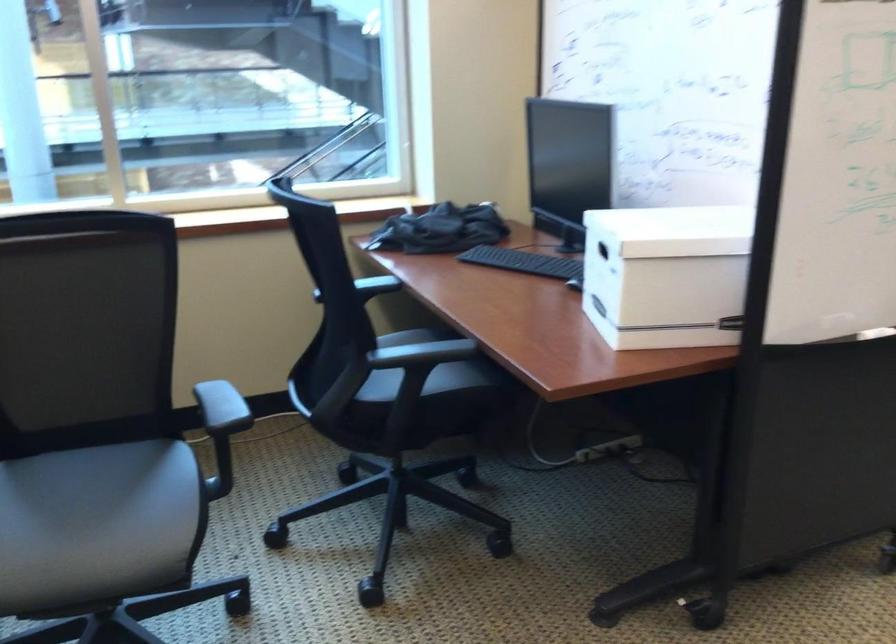
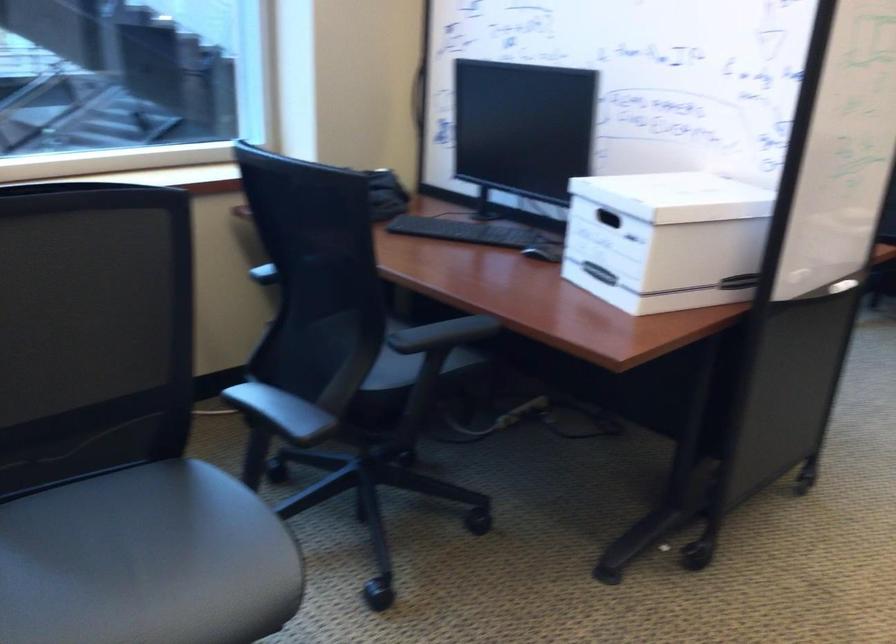
In the second image, find the point that corresponds to point (85, 509) in the first image.

(145, 561)